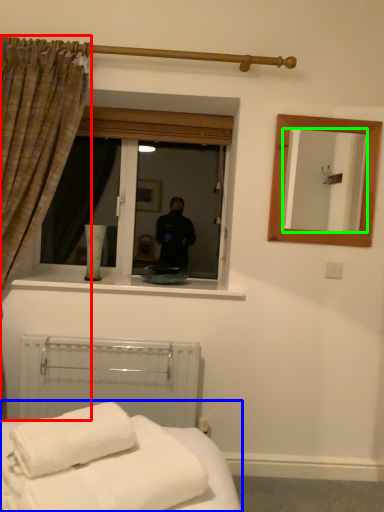
Question: Based on their relative distances, which object is nearer to curtain (highlighted by a red box)? Choose from bed (highlighted by a blue box) and mirror (highlighted by a green box).

Choices:
 (A) bed
 (B) mirror

Answer: (A)